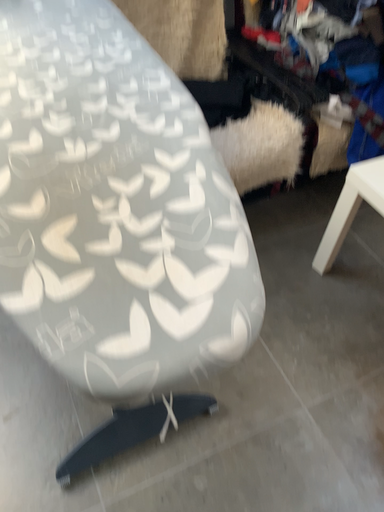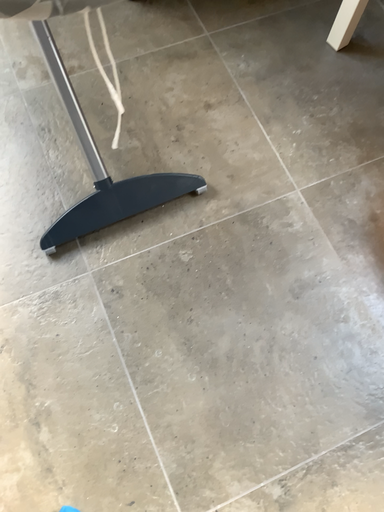
Question: How did the camera likely rotate when shooting the video?

Choices:
 (A) rotated downward
 (B) rotated upward

Answer: (A)